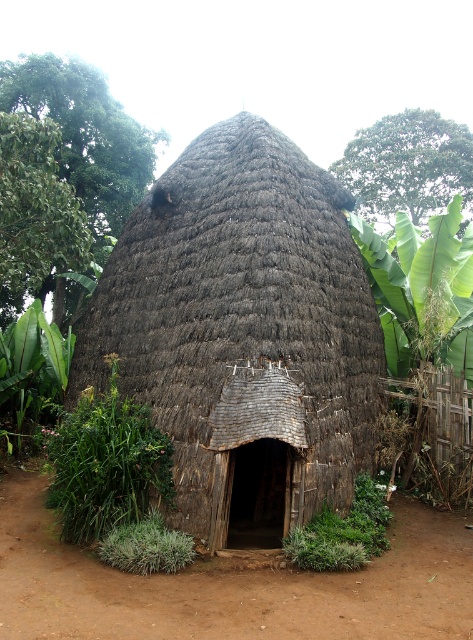
Does green leafy plant at center have a larger size compared to green leafy plant at lower left?

Yes.

Does green leafy plant at center lie in front of green leafy plant at lower left?

No, green leafy plant at center is behind green leafy plant at lower left.

Who is more distant from viewer, (355,557) or (136,570)?

The point (355,557) is behind.

This screenshot has height=640, width=473. Find the location of `green leafy plant at center`. green leafy plant at center is located at coordinates (342, 532).

Does point (254, 513) come farther from viewer compared to point (315, 540)?

Yes, point (254, 513) is behind point (315, 540).

Can you confirm if brown thatch hut at center is positioned below green leafy plant at center?

No, brown thatch hut at center is not below green leafy plant at center.

Is point (227, 392) positioned in front of point (373, 548)?

No, (227, 392) is further to viewer.

Find the location of `brown thatch hut at center`. brown thatch hut at center is located at coordinates (243, 333).

Is point (186, 637) closer to camera compared to point (385, 544)?

Yes.

Identify the location of brown dirt field at center. (230, 586).

Find the location of a particular element. The height and width of the screenshot is (640, 473). brown dirt field at center is located at coordinates (230, 586).